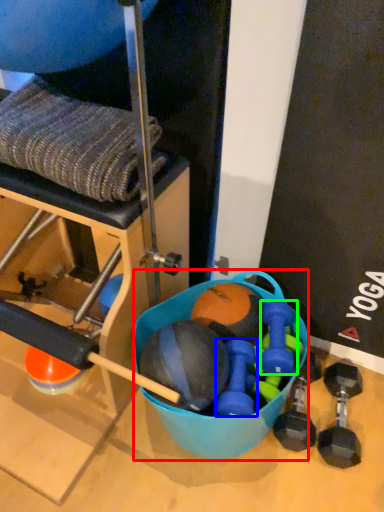
Question: Which object is the closest to the bowl (highlighted by a red box)? Choose among these: dumbbell (highlighted by a blue box) or dumbbell (highlighted by a green box).

Choices:
 (A) dumbbell
 (B) dumbbell

Answer: (A)